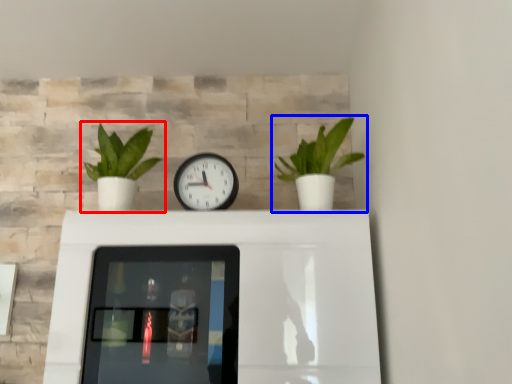
Question: Which object appears farthest to the camera in this image, houseplant (highlighted by a red box) or houseplant (highlighted by a blue box)?

Choices:
 (A) houseplant
 (B) houseplant

Answer: (A)